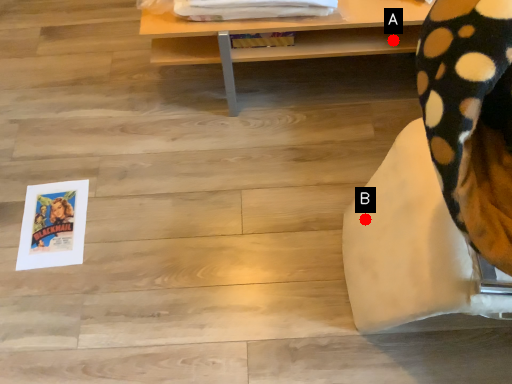
Question: Two points are circled on the image, labeled by A and B beside each circle. Which point appears farthest from the camera in this image?

Choices:
 (A) A is further
 (B) B is further

Answer: (A)